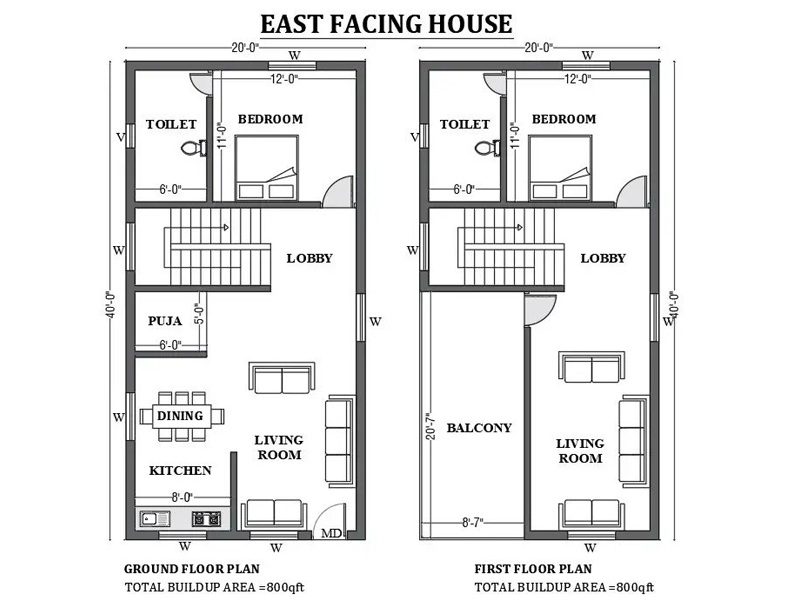
Where is `table`? The height and width of the screenshot is (600, 800). table is located at coordinates (178, 417).